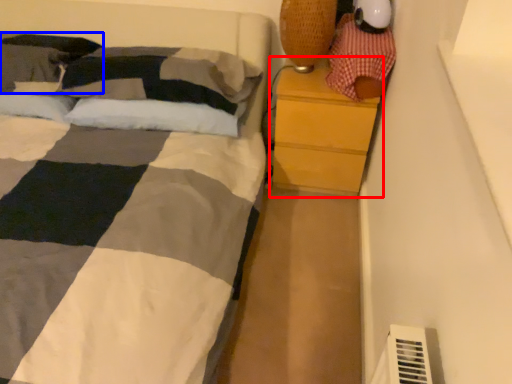
Question: Among these objects, which one is farthest to the camera, chest of drawers (highlighted by a red box) or pillow (highlighted by a blue box)?

Choices:
 (A) chest of drawers
 (B) pillow

Answer: (B)